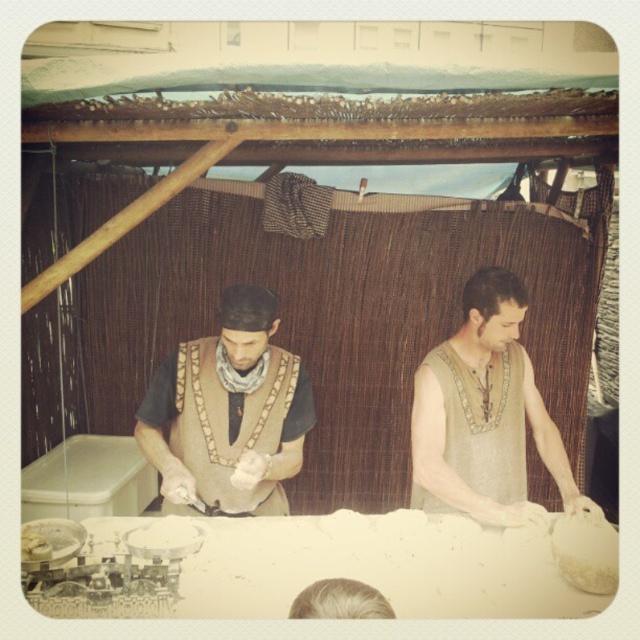
The width and height of the screenshot is (640, 640). Describe the element at coordinates (228, 412) in the screenshot. I see `brown woven vest at center` at that location.

Does brown woven vest at center come behind beige woven vest at right?

No, brown woven vest at center is closer to the viewer.

Measure the distance between brown woven vest at center and camera.

A distance of 2.34 meters exists between brown woven vest at center and camera.

You are a GUI agent. You are given a task and a screenshot of the screen. Output one action in this format:
    pyautogui.click(x=<x>, y=<y>)
    Task: Click on the brown woven vest at center
    Image resolution: width=640 pixels, height=640 pixels.
    Given the screenshot: What is the action you would take?
    [228, 412]

Can you confirm if white matte table at center is positioned to the left of brown woven vest at center?

No, white matte table at center is not to the left of brown woven vest at center.

Is white matte table at center in front of brown woven vest at center?

Yes, it is in front of brown woven vest at center.

Is point (280, 541) positioned after point (230, 445)?

No, it is in front of (230, 445).

You are a GUI agent. You are given a task and a screenshot of the screen. Output one action in this format:
    pyautogui.click(x=<x>, y=<y>)
    Task: Click on the white matte table at center
    This screenshot has height=640, width=640.
    Given the screenshot: What is the action you would take?
    pyautogui.click(x=308, y=568)

Is beige linen shirt at center to the right of beige woven vest at right from the viewer's perspective?

Correct, you'll find beige linen shirt at center to the right of beige woven vest at right.

Can you confirm if beige linen shirt at center is taller than beige woven vest at right?

Yes.

Who is more distant from viewer, (509, 330) or (467, 445)?

Point (467, 445)

This screenshot has width=640, height=640. Find the location of `beige linen shirt at center`. beige linen shirt at center is located at coordinates (483, 413).